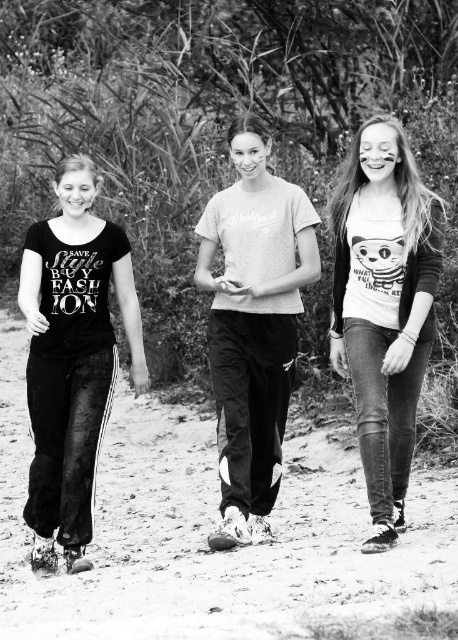
Question: Which point is farther to the camera?

Choices:
 (A) black matte t-shirt at left
 (B) white printed t-shirt at center
 (C) light gray cotton t-shirt at center
 (D) dirt track at center

Answer: (C)

Question: Based on their relative distances, which object is farther from the dirt track at center?

Choices:
 (A) white printed t-shirt at center
 (B) light gray cotton t-shirt at center

Answer: (A)

Question: Does dirt track at center have a lesser width compared to light gray cotton t-shirt at center?

Choices:
 (A) yes
 (B) no

Answer: (A)

Question: Does light gray cotton t-shirt at center appear under white printed t-shirt at center?

Choices:
 (A) yes
 (B) no

Answer: (A)

Question: In this image, where is white printed t-shirt at center located relative to black matte t-shirt at left?

Choices:
 (A) right
 (B) left

Answer: (A)

Question: Which of the following is the farthest from the observer?

Choices:
 (A) white printed t-shirt at center
 (B) dirt track at center
 (C) light gray cotton t-shirt at center

Answer: (C)